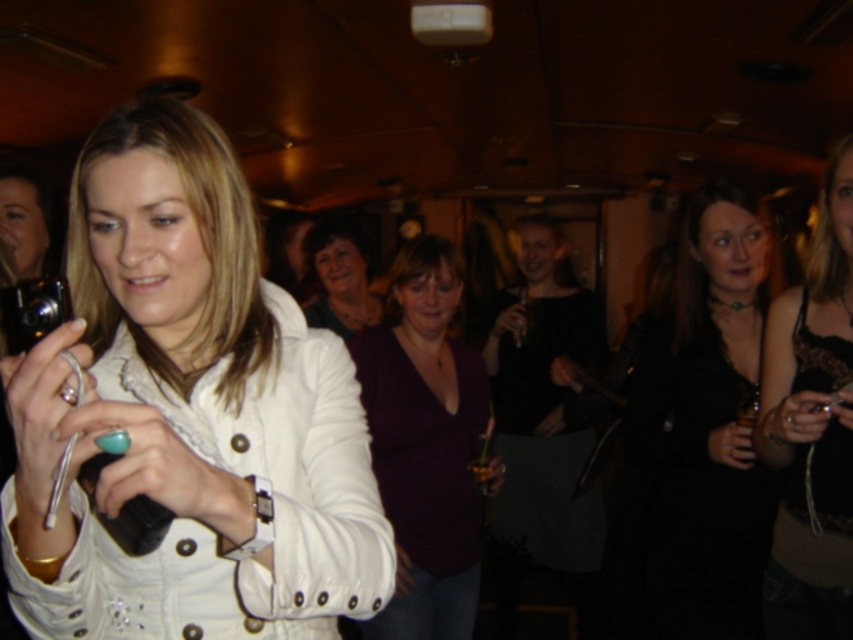
You are a photographer standing in the room and want to take a closeup shot of the white leather jacket at center. Your camera has a minimum focusing distance of 20 inches. Can you take the photo without moving closer?

The white leather jacket at center is 21.53 inches away from the camera, which is beyond the minimum focusing distance of 20 inches. Therefore, you can take the closeup shot without needing to move closer.

You are standing in the room and want to take a photo of the matte purple shirt at center. Where should you aim your camera to capture it?

The matte purple shirt at center is located at point 0.434 on the x axis and 0.400 on the y axis, so aim your camera towards those coordinates to capture it.

You are a photographer attending a party and see the white leather jacket at center and the matte black camera at left in the scene. Which object is taller?

The white leather jacket at center is much taller than the matte black camera at left.